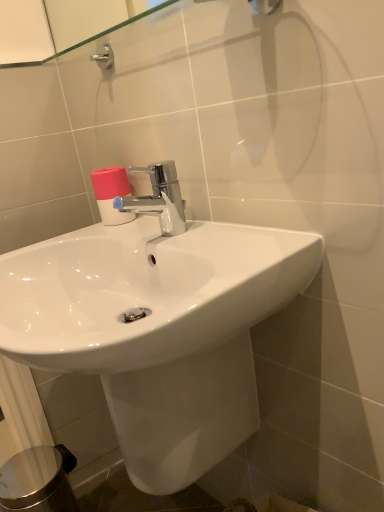
Image resolution: width=384 pixels, height=512 pixels. Identify the location of white glossy sink at center. (157, 323).

Image resolution: width=384 pixels, height=512 pixels. Describe the element at coordinates (157, 323) in the screenshot. I see `white glossy sink at center` at that location.

Where is `white glossy sink at center`? This screenshot has height=512, width=384. white glossy sink at center is located at coordinates (157, 323).